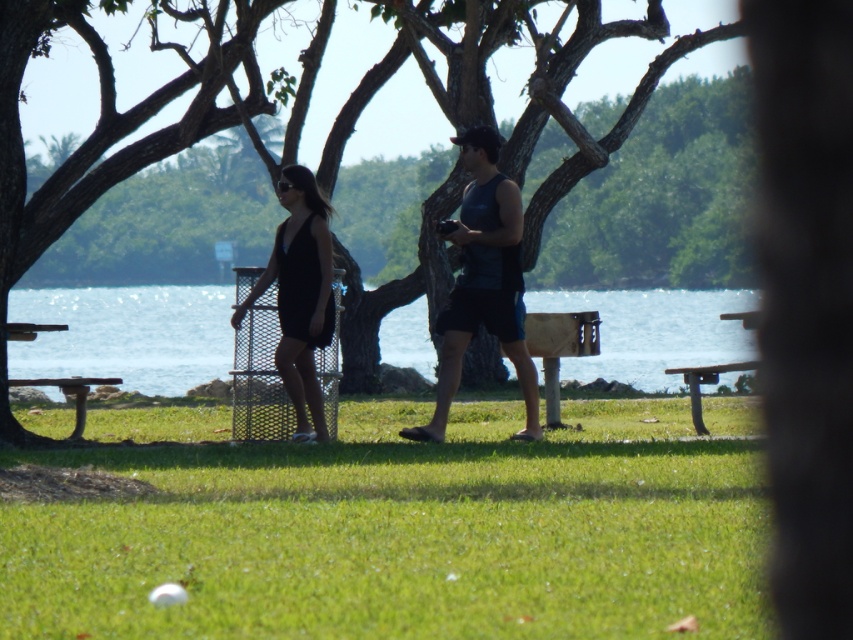
Question: Does clear blue water at center have a lesser width compared to wooden park bench at lower left?

Choices:
 (A) yes
 (B) no

Answer: (B)

Question: Among these objects, which one is farthest from the camera?

Choices:
 (A) green leafy tree at center
 (B) dark blue tank top at center
 (C) metallic silver picnic table at left

Answer: (C)

Question: Where is green grass at center located in relation to green leafy tree at center in the image?

Choices:
 (A) below
 (B) above

Answer: (A)

Question: Which point is closer to the camera?

Choices:
 (A) wooden picnic table at lower right
 (B) metallic silver picnic table at left
 (C) clear blue water at center

Answer: (B)

Question: Based on their relative distances, which object is nearer to the dark blue tank top at center?

Choices:
 (A) wooden park bench at lower left
 (B) clear blue water at center

Answer: (A)

Question: Can you confirm if black matte dress at center is positioned below wooden picnic table at lower right?

Choices:
 (A) yes
 (B) no

Answer: (B)